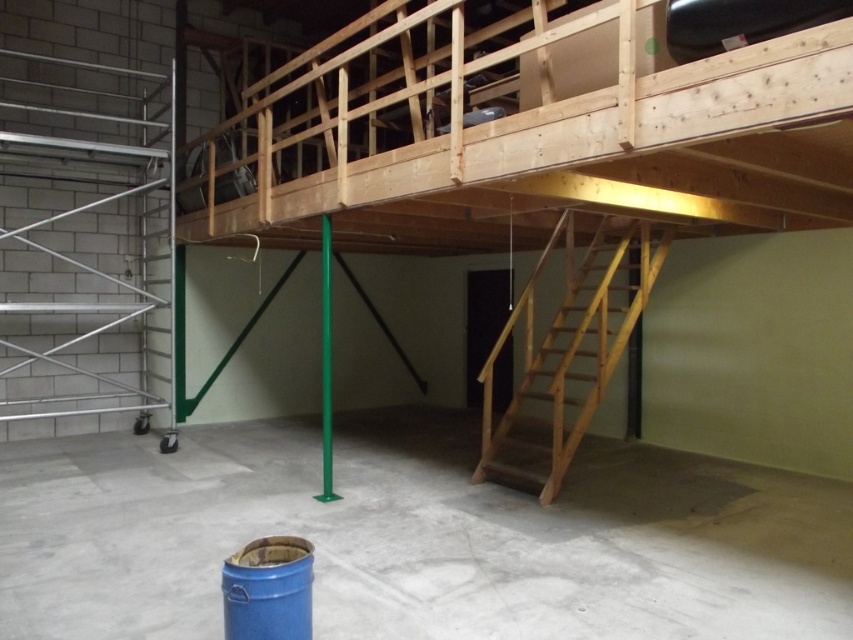
Image resolution: width=853 pixels, height=640 pixels. Identify the location of blue plastic barrel at lower left. (416, 538).

Can you confirm if blue plastic barrel at lower left is positioned above natural wood staircase at lower right?

Incorrect, blue plastic barrel at lower left is not positioned above natural wood staircase at lower right.

Is point (315, 504) positioned after point (532, 321)?

No, (315, 504) is in front of (532, 321).

Image resolution: width=853 pixels, height=640 pixels. Identify the location of blue plastic barrel at lower left. (416, 538).